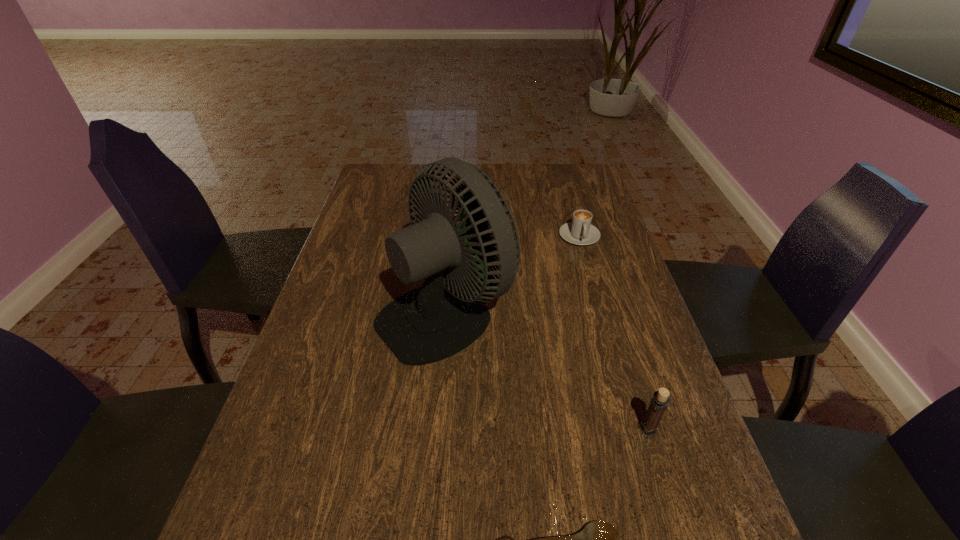
You are a GUI agent. You are given a task and a screenshot of the screen. Output one action in this format:
    pyautogui.click(x=<x>, y=<y>)
    Task: Click on the candle holder present at the right edge
    The height and width of the screenshot is (540, 960).
    Given the screenshot: What is the action you would take?
    pyautogui.click(x=660, y=401)

Find the location of `cappuccino present at the right edge`. cappuccino present at the right edge is located at coordinates (580, 231).

Where is `vacant space at the far edge of the desktop`? Image resolution: width=960 pixels, height=540 pixels. vacant space at the far edge of the desktop is located at coordinates (523, 182).

Where is `vacant region at the left edge`? This screenshot has height=540, width=960. vacant region at the left edge is located at coordinates (369, 246).

Image resolution: width=960 pixels, height=540 pixels. Find the location of `vacant space at the right edge`. vacant space at the right edge is located at coordinates (564, 199).

Identify the location of free space at the far left corner of the desktop. (380, 179).

At what (x,y) coordinates should I click in order to perform the action: click on unoccupied area between the candle holder and the tallest object. Please return your answer as a coordinate pair (x, y). Looking at the image, I should click on (546, 371).

This screenshot has width=960, height=540. Find the location of `vacant area that lies between the third shortest object and the tallest object`. vacant area that lies between the third shortest object and the tallest object is located at coordinates (546, 371).

I want to click on vacant region between the farthest object and the second tallest object, so click(613, 333).

You are a GUI agent. You are given a task and a screenshot of the screen. Output one action in this format:
    pyautogui.click(x=<x>, y=<y>)
    Task: Click on the third closest object to the farthest object
    The width and height of the screenshot is (960, 540).
    Given the screenshot: What is the action you would take?
    pyautogui.click(x=599, y=539)